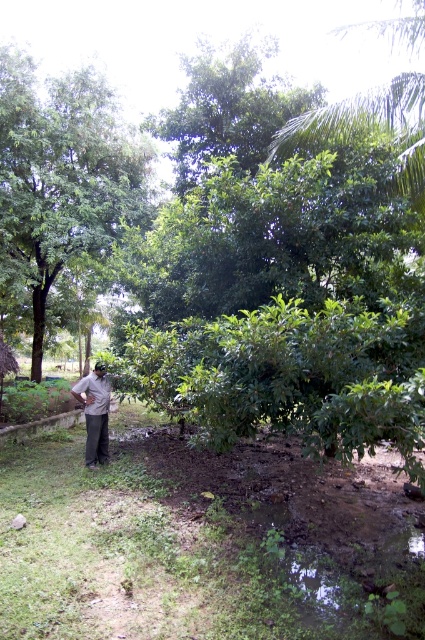
You are a gardener who wants to plant a new tree sapling that requires at least 3 meters of clearance above it to grow properly. Given the current layout of the garden, can you plant the sapling near the dark brown fabric at lower left without it being obstructed by the green leafy tree at left?

Result: The green leafy tree at left is much taller than the dark brown fabric at lower left. Since the tree is significantly taller, planting the sapling near the dark brown fabric at lower left may still be obstructed by the tree if it is too close. However, the exact distance between them isn

You are a gardener who wants to plant a new shrub in the garden. You have two options for locations based on the image. One is near the green leafy tree at left and the other is near the dark brown fabric at lower left. Which location would provide more space for the shrub to grow?

The green leafy tree at left has a larger size compared to the dark brown fabric at lower left, so planting near the green leafy tree at left would provide more space for the shrub to grow.